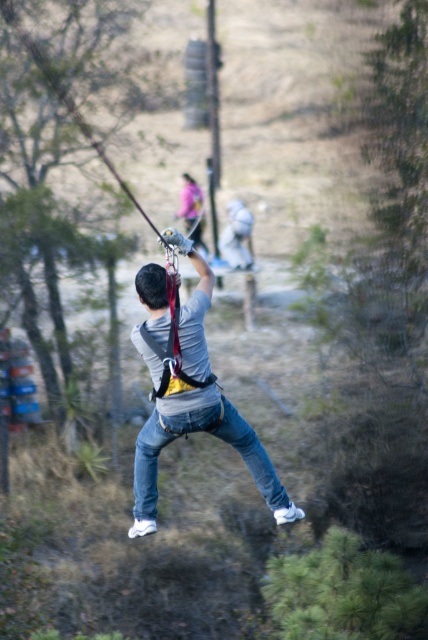
Is green leafy tree at lower right to the left of green leafy tree at center from the viewer's perspective?

In fact, green leafy tree at lower right is to the right of green leafy tree at center.

Consider the image. Who is more forward, (324, 593) or (44, 80)?

Point (324, 593)

The width and height of the screenshot is (428, 640). I want to click on green leafy tree at lower right, so click(344, 593).

Is denim jeans at center below green leafy tree at lower right?

Actually, denim jeans at center is above green leafy tree at lower right.

Who is higher up, denim jeans at center or green leafy tree at lower right?

Positioned higher is denim jeans at center.

Which is in front, point (181, 340) or point (303, 568)?

Point (181, 340) is more forward.

Find the location of a particular element. The width and height of the screenshot is (428, 640). denim jeans at center is located at coordinates (198, 412).

From the picture: Is green leafy tree at lower right above matte gray helmet at upper center?

Actually, green leafy tree at lower right is below matte gray helmet at upper center.

The height and width of the screenshot is (640, 428). Find the location of `green leafy tree at lower right`. green leafy tree at lower right is located at coordinates (344, 593).